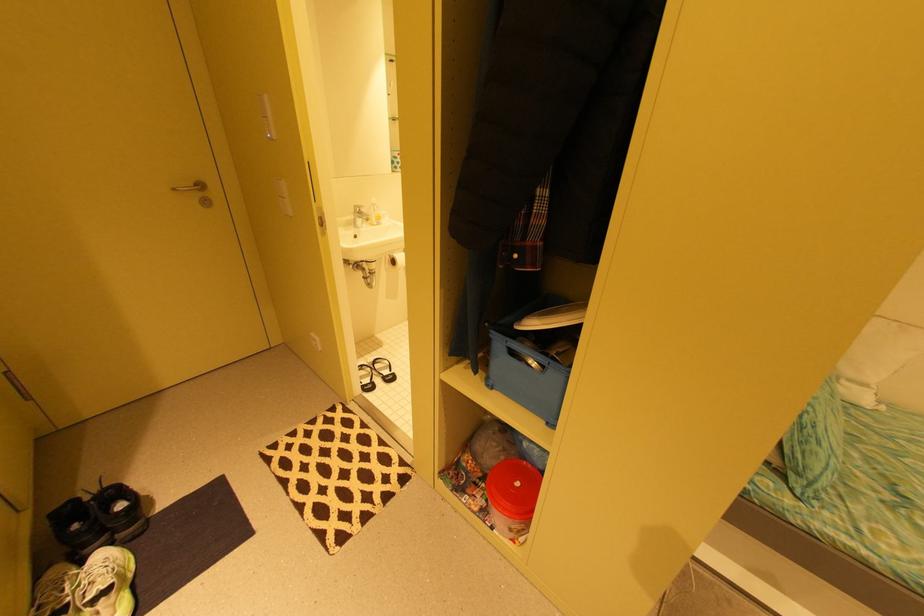
The location [375,373] corresponds to which object?

It refers to a black sandal.